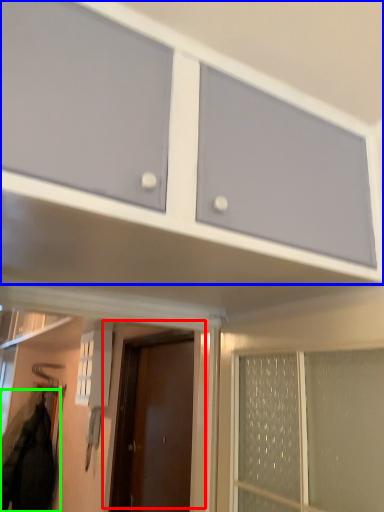
Question: Which object is positioned closest to door (highlighted by a red box)? Select from cabinetry (highlighted by a blue box) and jacket (highlighted by a green box).

Choices:
 (A) cabinetry
 (B) jacket

Answer: (B)